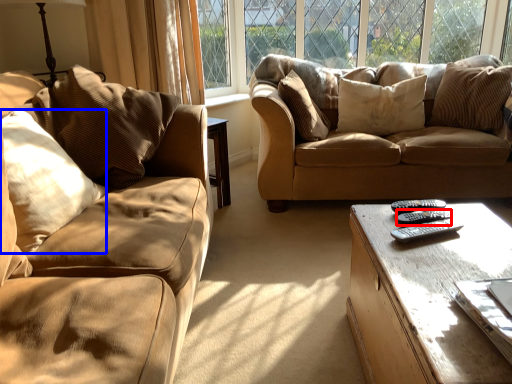
Question: Which object appears farthest to the camera in this image, remote (highlighted by a red box) or pillow (highlighted by a blue box)?

Choices:
 (A) remote
 (B) pillow

Answer: (A)